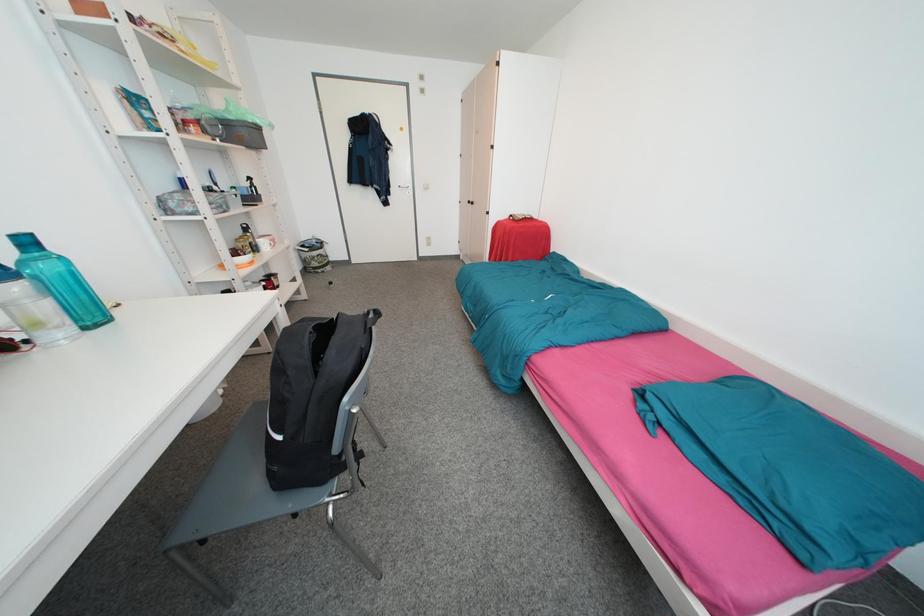
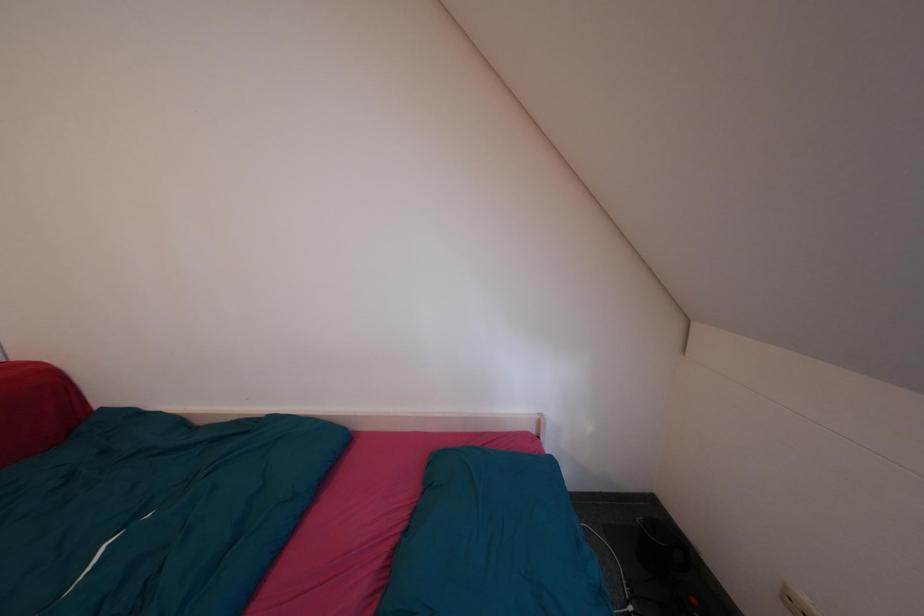
Question: How did the camera likely rotate?

Choices:
 (A) Left
 (B) Right
 (C) Up
 (D) Down

Answer: (B)